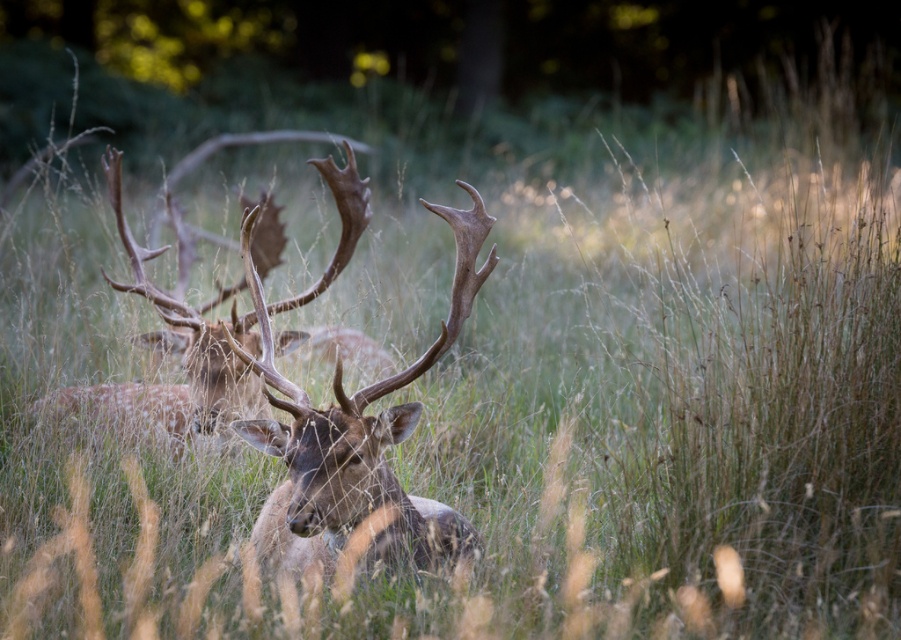
Can you confirm if brown fur antlers at center is taller than brown velvet antlers at center?

Incorrect, brown fur antlers at center's height is not larger of brown velvet antlers at center's.

Identify the location of brown fur antlers at center. The height and width of the screenshot is (640, 901). (356, 442).

At what (x,y) coordinates should I click in order to perform the action: click on brown fur antlers at center. Please return your answer as a coordinate pair (x, y). Looking at the image, I should click on (356, 442).